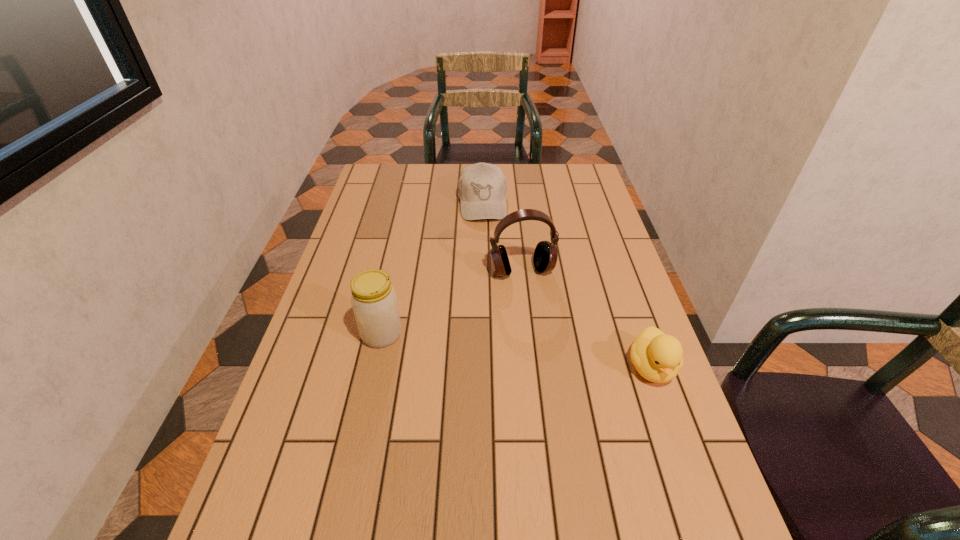
Locate an element on the screen. free spot between the duck and the farthest object is located at coordinates (566, 285).

The width and height of the screenshot is (960, 540). Find the location of `the second closest object relative to the leftmost object`. the second closest object relative to the leftmost object is located at coordinates [482, 188].

Where is `object that is the closest to the headset`? The image size is (960, 540). object that is the closest to the headset is located at coordinates (482, 188).